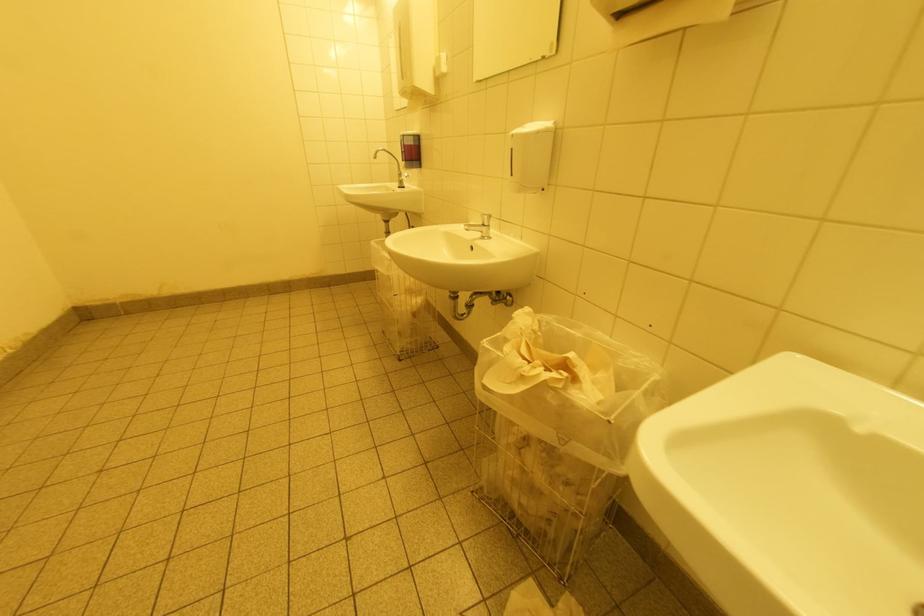
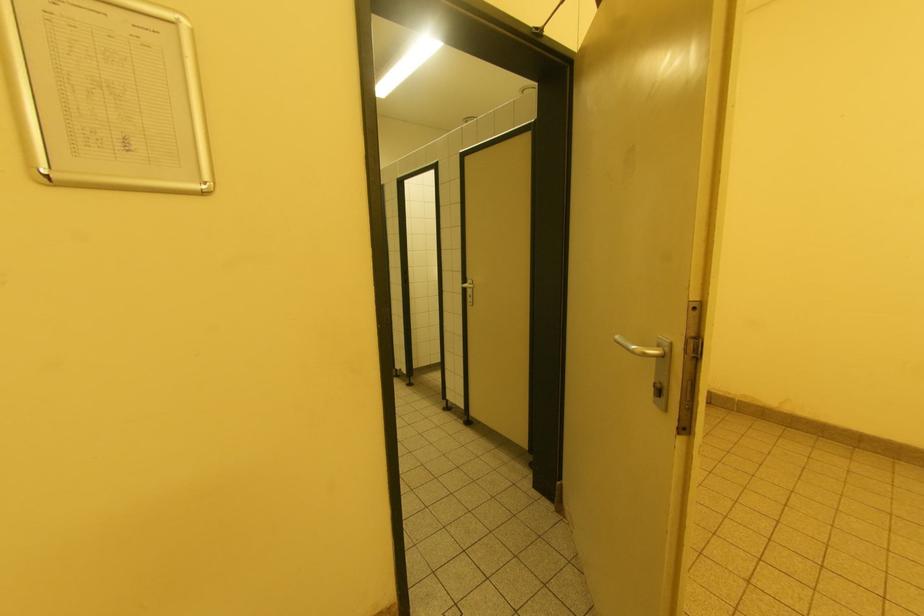
Question: The camera is either moving clockwise (left) or counter-clockwise (right) around the object. The first image is from the beginning of the video and the second image is from the end. Is the camera moving left or right when shooting the video?

Choices:
 (A) Left
 (B) Right

Answer: (B)